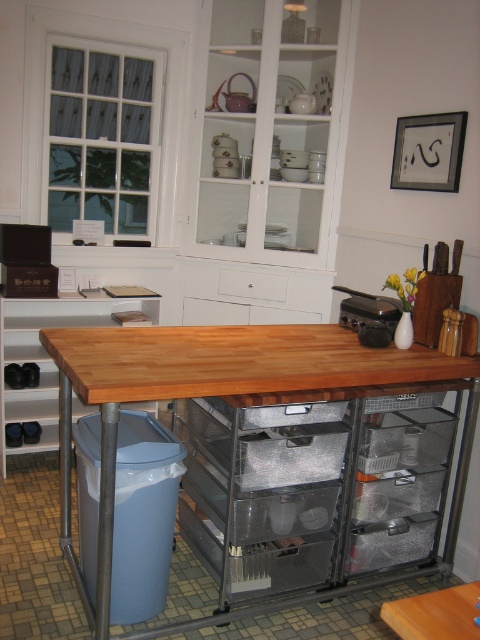
Question: Among these objects, which one is nearest to the camera?

Choices:
 (A) wooden table at center
 (B) white glossy cabinet at upper center

Answer: (A)

Question: Among these objects, which one is farthest from the camera?

Choices:
 (A) wooden table at center
 (B) white glossy cabinet at upper center

Answer: (B)

Question: Among these points, which one is nearest to the camera?

Choices:
 (A) (204, 365)
 (B) (336, 205)

Answer: (A)

Question: Is white glossy cabinet at upper center behind wooden table at center?

Choices:
 (A) yes
 (B) no

Answer: (A)

Question: Is white glossy cabinet at upper center bigger than wooden table at center?

Choices:
 (A) yes
 (B) no

Answer: (B)

Question: Is white glossy cabinet at upper center to the right of wooden table at center from the viewer's perspective?

Choices:
 (A) yes
 (B) no

Answer: (A)